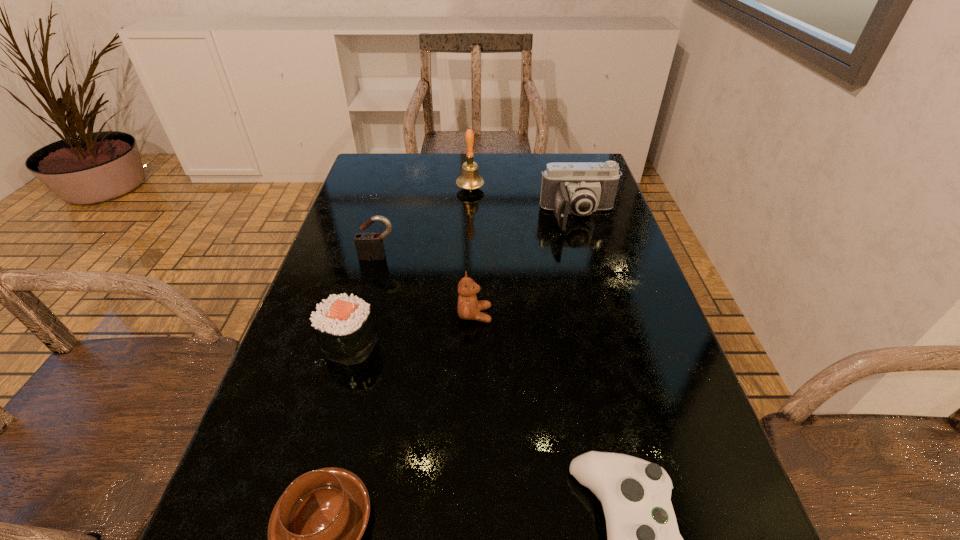
You are a GUI agent. You are given a task and a screenshot of the screen. Output one action in this format:
    pyautogui.click(x=<x>, y=<y>)
    Task: Click on the bell
    The width and height of the screenshot is (960, 540).
    Given the screenshot: What is the action you would take?
    pyautogui.click(x=469, y=179)

You are a GUI agent. You are given a task and a screenshot of the screen. Output one action in this format:
    pyautogui.click(x=<x>, y=<y>)
    Task: Click on the tallest object
    
    Given the screenshot: What is the action you would take?
    pyautogui.click(x=469, y=179)

What are the coordinates of `the second farthest object` in the screenshot? It's located at (580, 188).

Where is `the fifth nearest object`? Image resolution: width=960 pixels, height=540 pixels. the fifth nearest object is located at coordinates (367, 245).

This screenshot has width=960, height=540. What are the coordinates of `teddy bear` in the screenshot? It's located at (469, 308).

The height and width of the screenshot is (540, 960). Identify the location of sushi. (343, 324).

The height and width of the screenshot is (540, 960). I want to click on free space located 0.060m on the front of the bell, so click(469, 207).

Where is `vacant space located 0.240m at the front of the camera with an open lens cover`? The height and width of the screenshot is (540, 960). vacant space located 0.240m at the front of the camera with an open lens cover is located at coordinates (603, 300).

Locate an element on the screen. vacant space located with the keyhole on the front of the padlock is located at coordinates (352, 353).

This screenshot has width=960, height=540. What are the coordinates of `vacant space located 0.150m on the face of the teddy bear` in the screenshot? It's located at (563, 315).